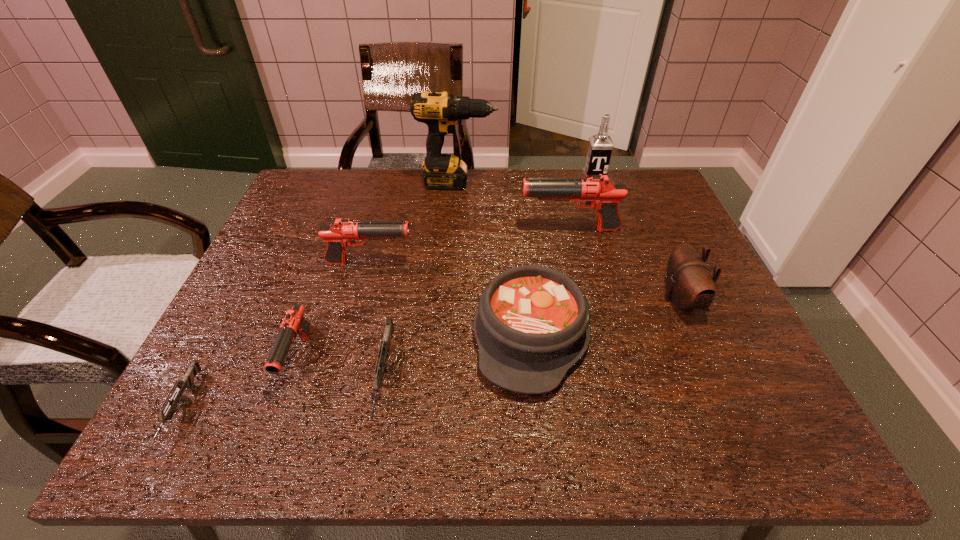
What are the coordinates of `object at the near left corner` in the screenshot? It's located at (187, 382).

The image size is (960, 540). In the image, there is a desktop. Find the location of `vacant space at the far edge`. vacant space at the far edge is located at coordinates (588, 210).

This screenshot has width=960, height=540. I want to click on free location at the left edge, so click(x=239, y=312).

Locate an element on the screen. This screenshot has height=540, width=960. vacant space at the right edge of the desktop is located at coordinates (726, 315).

Find the location of a particular element. The height and width of the screenshot is (540, 960). vacant space at the far left corner of the desktop is located at coordinates (294, 208).

The image size is (960, 540). In the image, there is a desktop. Identify the location of vacant space at the far right corner. (623, 214).

In the image, there is a desktop. Find the location of `free space at the near right corner`. free space at the near right corner is located at coordinates click(x=747, y=433).

Locate an element on the screen. The width and height of the screenshot is (960, 540). vacant area between the seventh nearest object and the rightmost object is located at coordinates (625, 265).

Identify the location of vacant space in between the pouch and the leftmost gun. (431, 354).

This screenshot has width=960, height=540. Find the location of `unoccupied area between the left grey gun and the third shortest gun`. unoccupied area between the left grey gun and the third shortest gun is located at coordinates (240, 383).